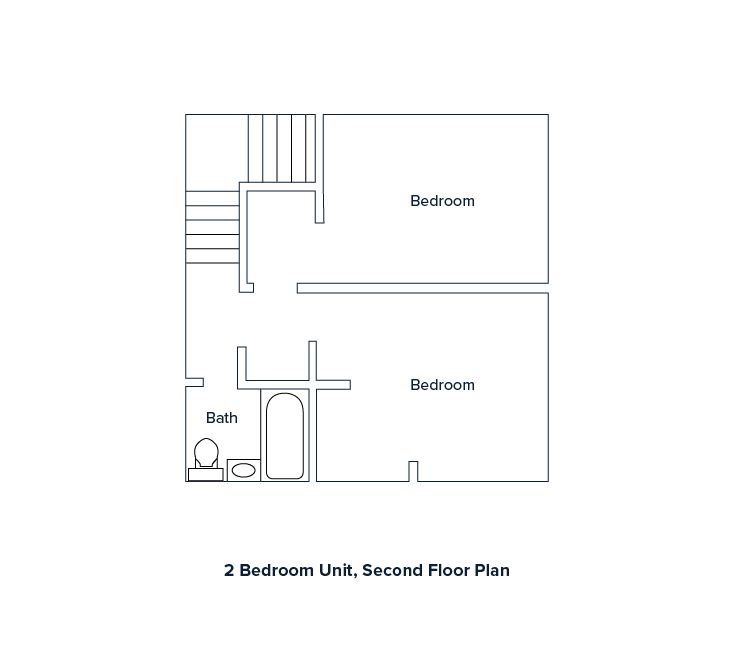
This screenshot has width=734, height=649. In order to click on upper floor in this screenshot , I will do `click(396, 161)`.